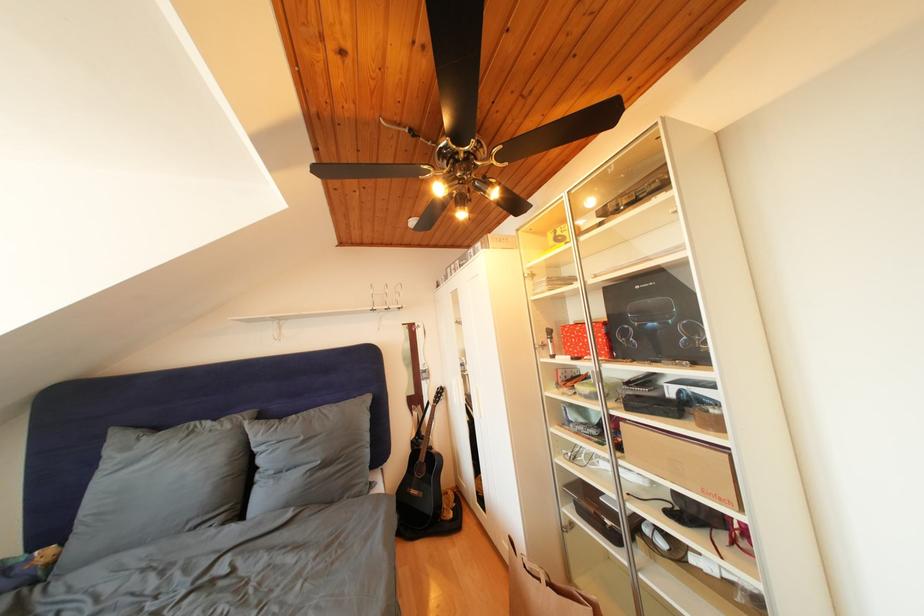
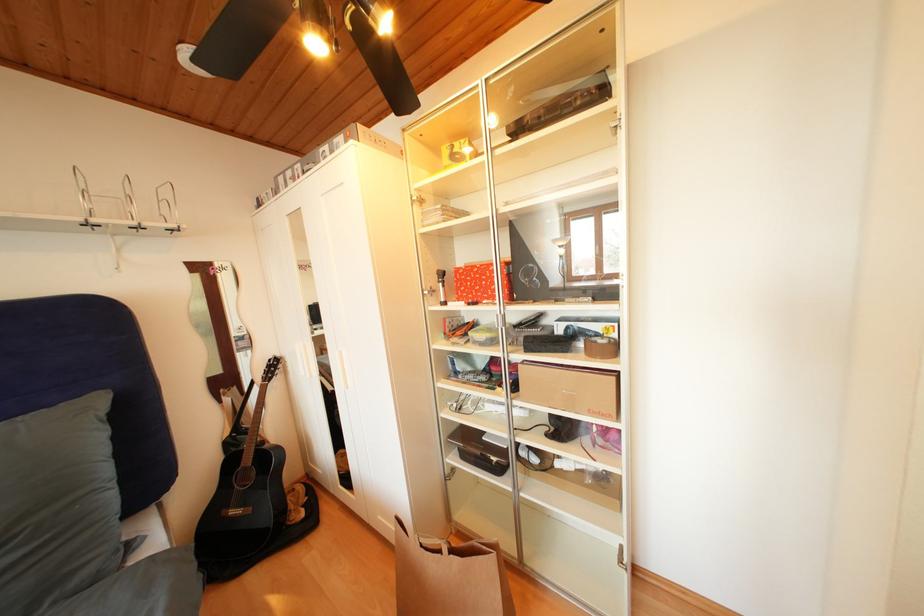
Question: The first image is from the beginning of the video and the second image is from the end. How did the camera likely rotate when shooting the video?

Choices:
 (A) Left
 (B) Right
 (C) Up
 (D) Down

Answer: (B)